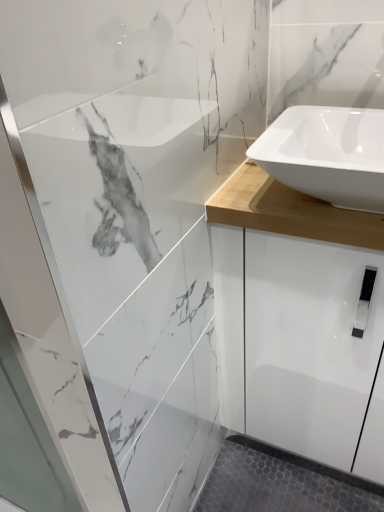
Question: Should I look upward or downward to see white glossy sink at upper right?

Choices:
 (A) up
 (B) down

Answer: (A)